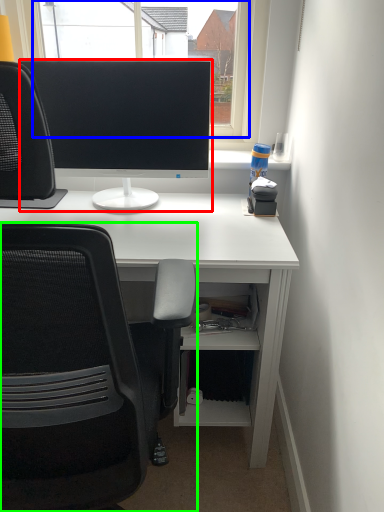
Question: Which is farther away from computer monitor (highlighted by a red box)? window screen (highlighted by a blue box) or chair (highlighted by a green box)?

Choices:
 (A) window screen
 (B) chair

Answer: (B)